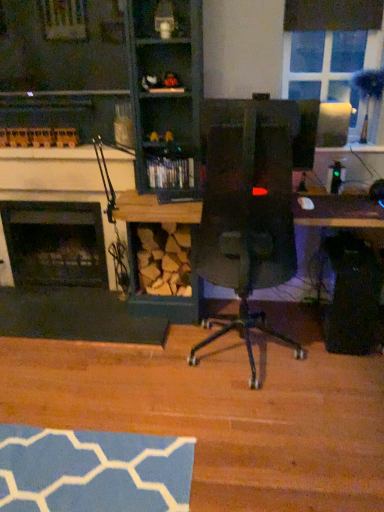
Locate an element on the screen. This screenshot has height=512, width=384. black matte fireplace at left, the 1th fireplace from the back is located at coordinates (55, 243).

This screenshot has width=384, height=512. What do you see at coordinates (55, 181) in the screenshot?
I see `black glass fireplace at left, which appears as the first fireplace when viewed from the front` at bounding box center [55, 181].

What do you see at coordinates (172, 173) in the screenshot? I see `wooden shelf at center, which is counted as the first shelf, starting from the back` at bounding box center [172, 173].

Locate an element on the screen. This screenshot has width=384, height=512. clear glass window at upper right is located at coordinates (330, 67).

From a real-world perspective, is wooden shelf at upper center, the 2th shelf viewed from the back, physically located above or below black matte fireplace at left, marked as the 2th fireplace in a front-to-back arrangement?

In terms of real-world spatial position, wooden shelf at upper center, the 2th shelf viewed from the back, is above black matte fireplace at left, marked as the 2th fireplace in a front-to-back arrangement.

Is wooden shelf at upper center, the 2th shelf ordered from the bottom, bigger or smaller than black matte fireplace at left, the 1th fireplace from the back?

In the image, wooden shelf at upper center, the 2th shelf ordered from the bottom, appears to be smaller than black matte fireplace at left, the 1th fireplace from the back.

Does wooden shelf at upper center, the 2th shelf viewed from the back, touch black matte fireplace at left, the 1th fireplace from the back?

wooden shelf at upper center, the 2th shelf viewed from the back, and black matte fireplace at left, the 1th fireplace from the back, are clearly separated.

Is black glass fireplace at left, which appears as the first fireplace when viewed from the front, positioned with its back to black matte fireplace at left, the 1th fireplace from the back?

Yes, black glass fireplace at left, which appears as the first fireplace when viewed from the front, is facing away from black matte fireplace at left, the 1th fireplace from the back.

What's the angular difference between black glass fireplace at left, which appears as the first fireplace when viewed from the front, and black matte fireplace at left, marked as the 2th fireplace in a front-to-back arrangement,'s facing directions?

0.00152 degrees separate the facing orientations of black glass fireplace at left, which appears as the first fireplace when viewed from the front, and black matte fireplace at left, marked as the 2th fireplace in a front-to-back arrangement.

From the image's perspective, which one is positioned lower, black glass fireplace at left, which appears as the first fireplace when viewed from the front, or black matte fireplace at left, the 1th fireplace from the back?

black matte fireplace at left, the 1th fireplace from the back, is shown below in the image.

Which is less distant, [15,187] or [61,212]?

Point [15,187]

Considering the points (50, 178) and (143, 14), which point is in front, point (50, 178) or point (143, 14)?

The point (143, 14) is closer.

From a real-world perspective, is black glass fireplace at left, positioned as the 2th fireplace in back-to-front order, above or below wooden shelf at upper center, the 1th shelf in the front-to-back sequence?

In terms of real-world spatial position, black glass fireplace at left, positioned as the 2th fireplace in back-to-front order, is below wooden shelf at upper center, the 1th shelf in the front-to-back sequence.

Is the depth of black glass fireplace at left, positioned as the 2th fireplace in back-to-front order, less than that of wooden shelf at upper center, the 2th shelf ordered from the bottom?

No, black glass fireplace at left, positioned as the 2th fireplace in back-to-front order, is further to the viewer.

Is black glass fireplace at left, which appears as the first fireplace when viewed from the front, oriented towards wooden shelf at upper center, the 1th shelf in the front-to-back sequence?

No, black glass fireplace at left, which appears as the first fireplace when viewed from the front, is not aimed at wooden shelf at upper center, the 1th shelf in the front-to-back sequence.

Between point (21, 150) and point (177, 170), which one is positioned in front?

The point (177, 170) is closer to the camera.

How far apart are black glass fireplace at left, which appears as the first fireplace when viewed from the front, and wooden shelf at center, which ranks as the 1th shelf in bottom-to-top order?

black glass fireplace at left, which appears as the first fireplace when viewed from the front, and wooden shelf at center, which ranks as the 1th shelf in bottom-to-top order, are 16.52 inches apart from each other.

Who is smaller, black glass fireplace at left, positioned as the 2th fireplace in back-to-front order, or wooden shelf at center, which appears as the 2th shelf when viewed from the top?

wooden shelf at center, which appears as the 2th shelf when viewed from the top.

From a real-world perspective, is black glass fireplace at left, which appears as the first fireplace when viewed from the front, physically above wooden fireplace at left?

Incorrect, from a real-world perspective, black glass fireplace at left, which appears as the first fireplace when viewed from the front, is lower than wooden fireplace at left.

Can you confirm if black glass fireplace at left, positioned as the 2th fireplace in back-to-front order, is taller than wooden fireplace at left?

Incorrect, the height of black glass fireplace at left, positioned as the 2th fireplace in back-to-front order, is not larger of that of wooden fireplace at left.

Which point is more forward, (23, 182) or (112, 83)?

Positioned in front is point (112, 83).

Is black glass fireplace at left, positioned as the 2th fireplace in back-to-front order, positioned with its back to wooden fireplace at left?

That's right, black glass fireplace at left, positioned as the 2th fireplace in back-to-front order, is facing away from wooden fireplace at left.

From a real-world perspective, which object rests below the other?

clear glass window at upper right, from a real-world perspective.

Is clear glass window at upper right in front of or behind wooden shelf at upper center, the 2th shelf viewed from the back, in the image?

→ clear glass window at upper right is behind wooden shelf at upper center, the 2th shelf viewed from the back.

Does point (326, 101) come closer to viewer compared to point (168, 25)?

That is False.

Is clear glass window at upper right far from wooden shelf at upper center, the 2th shelf ordered from the bottom?

clear glass window at upper right is near wooden shelf at upper center, the 2th shelf ordered from the bottom, not far away.

Is black matte fireplace at left, the 1th fireplace from the back, wider than wooden shelf at upper center, the 2th shelf ordered from the bottom?

Yes.

From a real-world perspective, is black matte fireplace at left, marked as the 2th fireplace in a front-to-back arrangement, positioned under wooden shelf at upper center, the 2th shelf ordered from the bottom, based on gravity?

Yes, from a real-world perspective, black matte fireplace at left, marked as the 2th fireplace in a front-to-back arrangement, is under wooden shelf at upper center, the 2th shelf ordered from the bottom.

Could you tell me if black matte fireplace at left, the 1th fireplace from the back, is turned towards wooden shelf at upper center, the 2th shelf ordered from the bottom?

No, black matte fireplace at left, the 1th fireplace from the back, is not facing towards wooden shelf at upper center, the 2th shelf ordered from the bottom.

Find the location of `the 2nd shelf above the black matte fireplace at left, the 1th fireplace from the back (from a real-world perspective)`. the 2nd shelf above the black matte fireplace at left, the 1th fireplace from the back (from a real-world perspective) is located at coordinates (160, 18).

Where is `fireplace behind the black glass fireplace at left, positioned as the 2th fireplace in back-to-front order`? This screenshot has width=384, height=512. fireplace behind the black glass fireplace at left, positioned as the 2th fireplace in back-to-front order is located at coordinates (55, 243).

Considering their positions, is black glass fireplace at left, which appears as the first fireplace when viewed from the front, positioned closer to black matte fireplace at left, the 1th fireplace from the back, than clear glass window at upper right?

black glass fireplace at left, which appears as the first fireplace when viewed from the front.

Which object lies nearer to the anchor point clear glass window at upper right, wooden shelf at center, which is counted as the first shelf, starting from the back, or wooden fireplace at left?

wooden shelf at center, which is counted as the first shelf, starting from the back, lies closer to clear glass window at upper right than the other object.

Looking at the image, which one is located closer to wooden fireplace at left, wooden shelf at center, which ranks as the 1th shelf in bottom-to-top order, or black glass fireplace at left, positioned as the 2th fireplace in back-to-front order?

black glass fireplace at left, positioned as the 2th fireplace in back-to-front order.

Considering their positions, is black matte fireplace at left, the 1th fireplace from the back, positioned closer to black glass fireplace at left, positioned as the 2th fireplace in back-to-front order, than wooden fireplace at left?

Answer: black matte fireplace at left, the 1th fireplace from the back, is closer to black glass fireplace at left, positioned as the 2th fireplace in back-to-front order.

Estimate the real-world distances between objects in this image. Which object is further from black matte fireplace at left, the 1th fireplace from the back, black glass fireplace at left, which appears as the first fireplace when viewed from the front, or wooden shelf at upper center, the 1th shelf in the front-to-back sequence?

wooden shelf at upper center, the 1th shelf in the front-to-back sequence, lies further to black matte fireplace at left, the 1th fireplace from the back, than the other object.

Estimate the real-world distances between objects in this image. Which object is closer to wooden shelf at upper center, the first shelf viewed from the top, black glass fireplace at left, which appears as the first fireplace when viewed from the front, or wooden fireplace at left?

wooden fireplace at left.

Considering their positions, is wooden fireplace at left positioned closer to black matte fireplace at left, the 1th fireplace from the back, than clear glass window at upper right?

wooden fireplace at left lies closer to black matte fireplace at left, the 1th fireplace from the back, than the other object.

Based on their spatial positions, is black glass fireplace at left, positioned as the 2th fireplace in back-to-front order, or clear glass window at upper right further from wooden shelf at upper center, the 2th shelf ordered from the bottom?

Among the two, black glass fireplace at left, positioned as the 2th fireplace in back-to-front order, is located further to wooden shelf at upper center, the 2th shelf ordered from the bottom.

Find the location of a particular element. The height and width of the screenshot is (512, 384). cabinetry between black glass fireplace at left, positioned as the 2th fireplace in back-to-front order, and clear glass window at upper right from left to right is located at coordinates (108, 80).

You are a GUI agent. You are given a task and a screenshot of the screen. Output one action in this format:
    pyautogui.click(x=<x>, y=<y>)
    Task: Click on the fireplace that lies between wooden shelf at upper center, the 1th shelf in the front-to-back sequence, and black matte fireplace at left, marked as the 2th fireplace in a front-to-back arrangement, from top to bottom
    
    Given the screenshot: What is the action you would take?
    pyautogui.click(x=55, y=181)

Locate an element on the screen. cabinetry between black matte fireplace at left, the 1th fireplace from the back, and clear glass window at upper right from left to right is located at coordinates [x=108, y=80].

Locate an element on the screen. The height and width of the screenshot is (512, 384). fireplace between black matte fireplace at left, marked as the 2th fireplace in a front-to-back arrangement, and clear glass window at upper right is located at coordinates (55, 181).